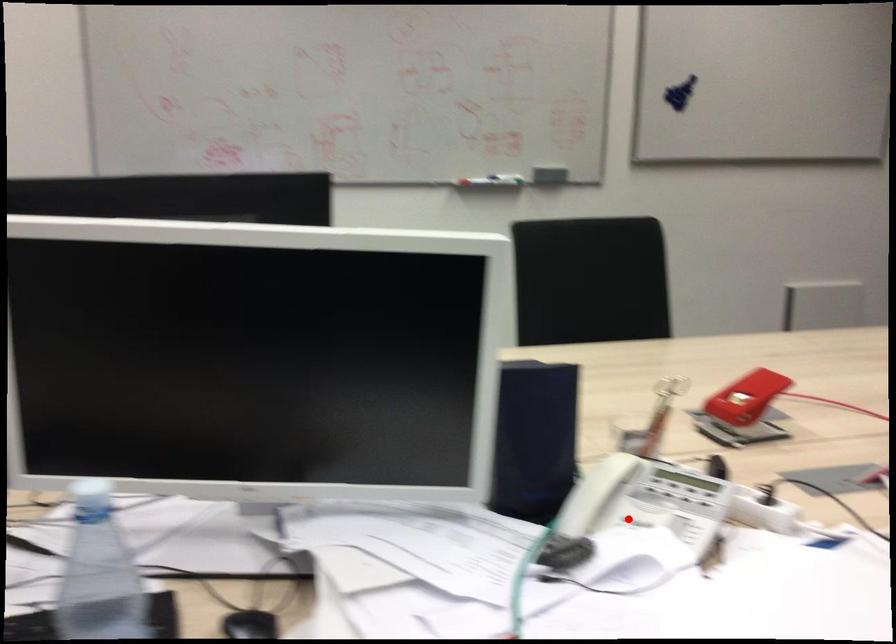
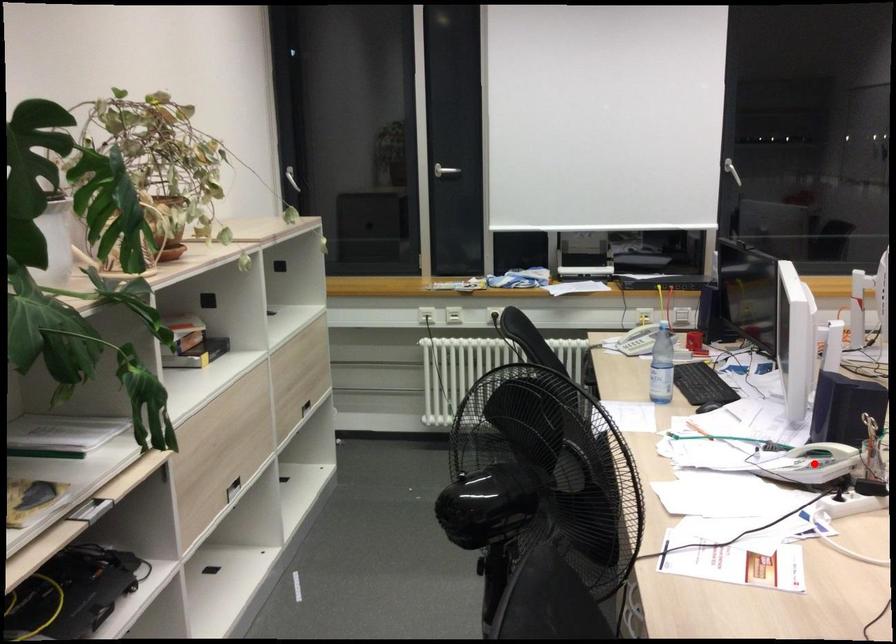
I am providing you with two images of the same scene from different viewpoints. A red point is marked on the first image and another point is marked on the second image. Are the points marked in image1 and image2 representing the same 3D position?

Yes